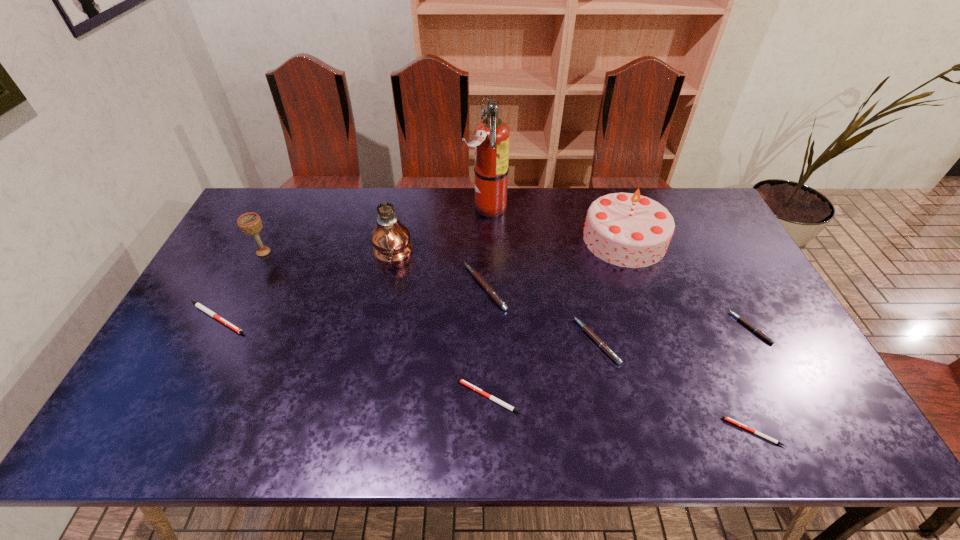
Identify the location of vacant space at the near left corner of the desktop. (171, 415).

The height and width of the screenshot is (540, 960). In order to click on free space between the chalice and the fifth tallest object in this screenshot , I will do `click(374, 269)`.

Locate an element on the screen. free space between the eighth object from right to left and the second smallest white pen is located at coordinates (441, 326).

Locate an element on the screen. The width and height of the screenshot is (960, 540). empty space between the biggest pink pen and the second nearest pen is located at coordinates (488, 342).

The height and width of the screenshot is (540, 960). In order to click on free area in between the fifth farthest pen and the leftmost white pen in this screenshot , I will do click(x=353, y=357).

I want to click on blank region between the birthday cake and the second biggest pink pen, so click(x=611, y=290).

I want to click on vacant point located between the shortest pen and the seventh shortest object, so click(508, 342).

You are a GUI agent. You are given a task and a screenshot of the screen. Output one action in this format:
    pyautogui.click(x=<x>, y=<y>)
    Task: Click on the vacant space in between the ninth shortest object and the fire extinguisher
    
    Given the screenshot: What is the action you would take?
    pyautogui.click(x=439, y=231)

The image size is (960, 540). Identify the location of object that ranks as the third closest to the smallest white pen. point(500,402).

Image resolution: width=960 pixels, height=540 pixels. Find the location of `object that is the third nearest to the seventh shortest object`. object that is the third nearest to the seventh shortest object is located at coordinates (489, 290).